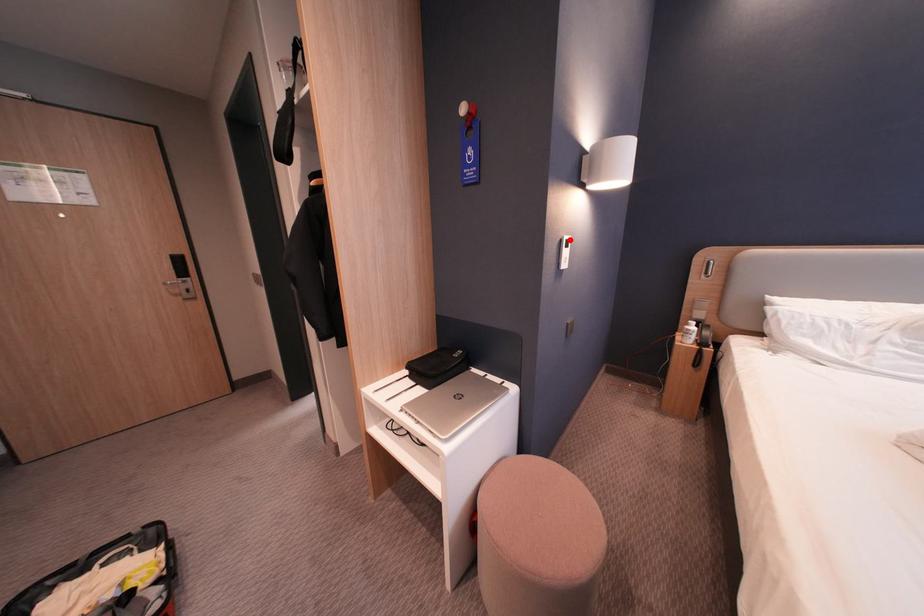
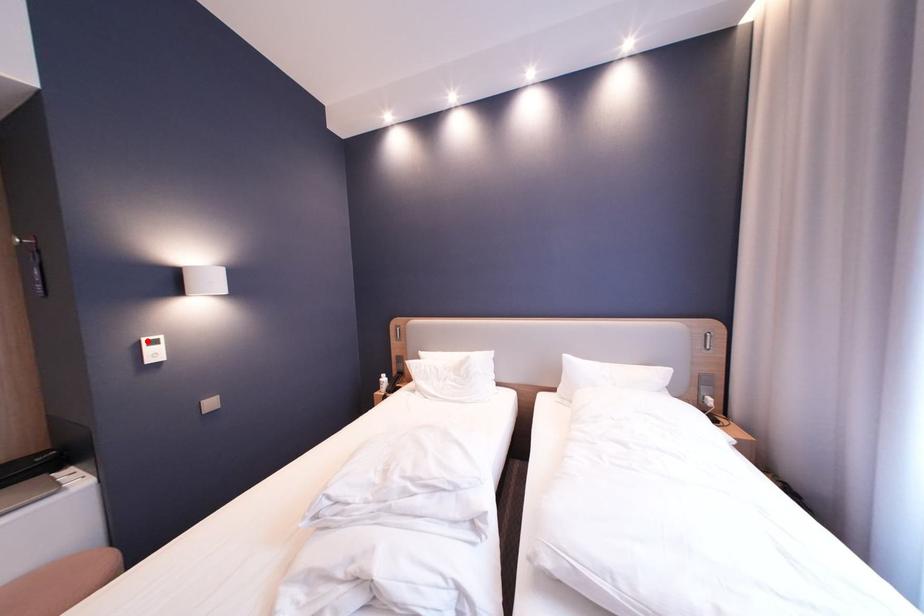
I am providing you with two images of the same scene from different viewpoints. A red point is marked on the first image and another point is marked on the second image. Do the highlighted points in image1 and image2 indicate the same real-world spot?

Yes